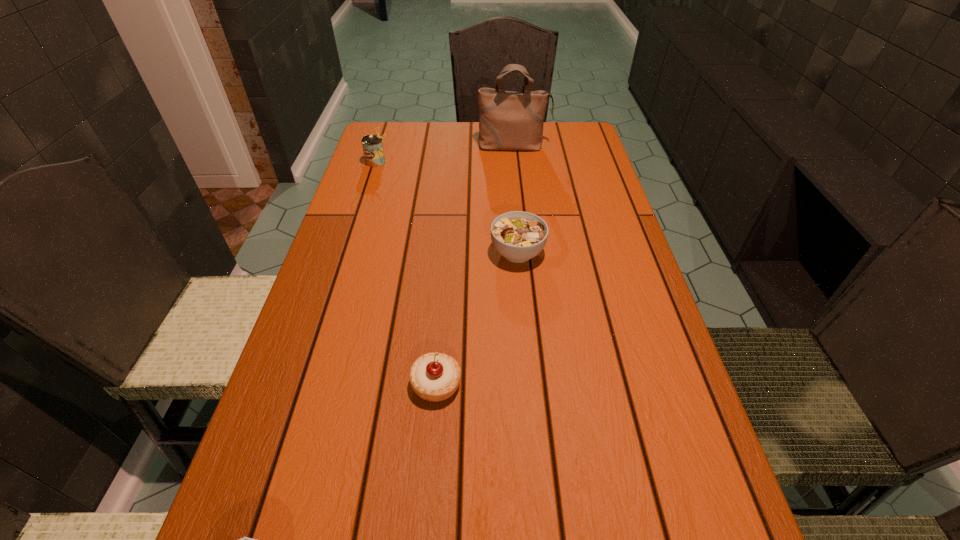
Find the location of a particular element. free region located on the back of the taller soup bowl is located at coordinates (510, 167).

Image resolution: width=960 pixels, height=540 pixels. Identify the location of vacant space located on the front of the fourth farthest object. (424, 534).

You are a GUI agent. You are given a task and a screenshot of the screen. Output one action in this format:
    pyautogui.click(x=<x>, y=<y>)
    Task: Click on the shoulder bag that is at the far edge
    
    Given the screenshot: What is the action you would take?
    pyautogui.click(x=508, y=120)

You are a GUI agent. You are given a task and a screenshot of the screen. Output one action in this format:
    pyautogui.click(x=<x>, y=<y>)
    Task: Click on the can present at the far edge
    
    Given the screenshot: What is the action you would take?
    pyautogui.click(x=372, y=145)

I want to click on object present at the left edge, so 372,145.

Find the location of a particular element. object that is positioned at the right edge is located at coordinates (508, 120).

Find the location of a particular element. Image resolution: width=960 pixels, height=540 pixels. object that is at the far left corner is located at coordinates (372, 145).

Locate an element on the screen. object that is at the far right corner is located at coordinates (508, 120).

The width and height of the screenshot is (960, 540). I want to click on free space at the far edge, so click(x=451, y=143).

Find the location of a particular element. free point at the left edge is located at coordinates (390, 204).